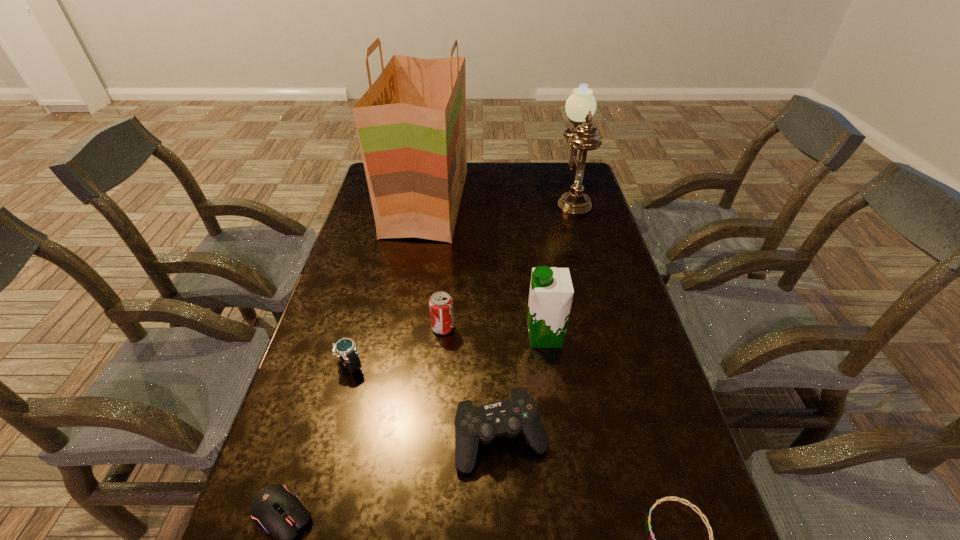
You are a GUI agent. You are given a task and a screenshot of the screen. Output one action in this format:
    pyautogui.click(x=<x>, y=<y>)
    Task: Click on the object that is at the right edge
    
    Given the screenshot: What is the action you would take?
    click(x=580, y=106)

Locate an element on the screen. object that is positioned at the far left corner is located at coordinates (411, 123).

Find the location of `object present at the far right corner`. object present at the far right corner is located at coordinates (580, 106).

In order to click on free space at the left edge of the desktop in this screenshot , I will do [309, 422].

Identify the location of vacant space at the right edge of the desktop. This screenshot has width=960, height=540. (610, 269).

I want to click on vacant space in between the watch and the grocery bag, so click(389, 284).

I want to click on free spot between the third nearest object and the watch, so click(x=426, y=402).

Identify the location of vacant space that's between the third shortest object and the tallest object. This screenshot has height=540, width=960. (389, 284).

Identify the location of vacant region between the oil lamp and the grocery bag. The width and height of the screenshot is (960, 540). (499, 199).

Locate an element on the screen. The width and height of the screenshot is (960, 540). free space between the fifth farthest object and the seventh shortest object is located at coordinates (461, 280).